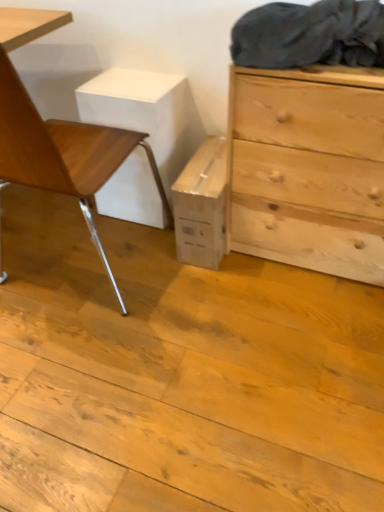
This screenshot has height=512, width=384. Describe the element at coordinates (308, 173) in the screenshot. I see `natural wood chest of drawers at right` at that location.

Image resolution: width=384 pixels, height=512 pixels. Describe the element at coordinates (58, 135) in the screenshot. I see `wooden chair at left` at that location.

At what (x,y) coordinates should I click in order to perform the action: click on natural wood chest of drawers at right. Please return your answer as a coordinate pair (x, y). The width and height of the screenshot is (384, 512). Looking at the image, I should click on (308, 173).

Consider the image. What's the angular difference between wooden chair at left and dark gray fabric at upper right's facing directions?

There is a 180-degree angle between the facing directions of wooden chair at left and dark gray fabric at upper right.

Considering the positions of points (56, 13) and (286, 5), is point (56, 13) farther from camera compared to point (286, 5)?

Yes, it is behind point (286, 5).

From the image's perspective, relative to dark gray fabric at upper right, is wooden chair at left above or below?

wooden chair at left is below dark gray fabric at upper right.

Based on their positions, is wooden chair at left located to the left or right of dark gray fabric at upper right?

In the image, wooden chair at left appears on the left side of dark gray fabric at upper right.

From the picture: From the image's perspective, is natural wood chest of drawers at right above or below dark gray fabric at upper right?

From the image's perspective, natural wood chest of drawers at right appears below dark gray fabric at upper right.

From a real-world perspective, is natural wood chest of drawers at right physically below dark gray fabric at upper right?

Yes, from a real-world perspective, natural wood chest of drawers at right is below dark gray fabric at upper right.

Considering their positions, is natural wood chest of drawers at right located in front of or behind dark gray fabric at upper right?

Visually, natural wood chest of drawers at right is located behind dark gray fabric at upper right.

Considering the relative sizes of natural wood chest of drawers at right and dark gray fabric at upper right in the image provided, is natural wood chest of drawers at right wider than dark gray fabric at upper right?

Yes, natural wood chest of drawers at right is wider than dark gray fabric at upper right.

What are the coordinates of `chest of drawers on the right of the wooden chair at left` in the screenshot? It's located at (308, 173).

From a real-world perspective, is natural wood chest of drawers at right above or below wooden chair at left?

In terms of real-world spatial position, natural wood chest of drawers at right is below wooden chair at left.

Considering the positions of objects natural wood chest of drawers at right and wooden chair at left in the image provided, who is behind, natural wood chest of drawers at right or wooden chair at left?

natural wood chest of drawers at right.

Based on their sizes in the image, would you say natural wood chest of drawers at right is bigger or smaller than wooden chair at left?

natural wood chest of drawers at right is smaller than wooden chair at left.

From their relative heights in the image, would you say dark gray fabric at upper right is taller or shorter than wooden chair at left?

Considering their sizes, dark gray fabric at upper right has less height than wooden chair at left.

From the image's perspective, between dark gray fabric at upper right and wooden chair at left, which one is located above?

dark gray fabric at upper right is shown above in the image.

Locate an element on the screen. Image resolution: width=384 pixels, height=512 pixels. laundry behind the wooden chair at left is located at coordinates (310, 35).

Looking at this image, how different are the orientations of dark gray fabric at upper right and natural wood chest of drawers at right in degrees?

The facing directions of dark gray fabric at upper right and natural wood chest of drawers at right are 0.00122 degrees apart.

Considering the sizes of objects dark gray fabric at upper right and natural wood chest of drawers at right in the image provided, who is bigger, dark gray fabric at upper right or natural wood chest of drawers at right?

Bigger between the two is natural wood chest of drawers at right.

Considering their positions, is dark gray fabric at upper right located in front of or behind natural wood chest of drawers at right?

In the image, dark gray fabric at upper right appears in front of natural wood chest of drawers at right.

In terms of width, does dark gray fabric at upper right look wider or thinner when compared to natural wood chest of drawers at right?

Considering their sizes, dark gray fabric at upper right looks slimmer than natural wood chest of drawers at right.

Is wooden chair at left outside of natural wood chest of drawers at right?

Yes, wooden chair at left is outside of natural wood chest of drawers at right.

How different are the orientations of wooden chair at left and natural wood chest of drawers at right in degrees?

They differ by 180 degrees in their facing directions.

From a real-world perspective, does wooden chair at left stand above natural wood chest of drawers at right?

Yes, from a real-world perspective, wooden chair at left is over natural wood chest of drawers at right

From the image's perspective, between wooden chair at left and natural wood chest of drawers at right, which one is located above?

wooden chair at left.

Where is `chair below the dark gray fabric at upper right (from a real-world perspective)`? chair below the dark gray fabric at upper right (from a real-world perspective) is located at coordinates (58, 135).

The width and height of the screenshot is (384, 512). I want to click on chest of drawers on the right of dark gray fabric at upper right, so click(x=308, y=173).

Based on their spatial positions, is wooden chair at left or dark gray fabric at upper right closer to natural wood chest of drawers at right?

The object closer to natural wood chest of drawers at right is dark gray fabric at upper right.

When comparing their distances from dark gray fabric at upper right, does wooden chair at left or natural wood chest of drawers at right seem further?

wooden chair at left is positioned further to the anchor dark gray fabric at upper right.

When comparing their distances from wooden chair at left, does dark gray fabric at upper right or natural wood chest of drawers at right seem further?

Based on the image, dark gray fabric at upper right appears to be further to wooden chair at left.

Based on their spatial positions, is natural wood chest of drawers at right or wooden chair at left closer to dark gray fabric at upper right?

natural wood chest of drawers at right lies closer to dark gray fabric at upper right than the other object.

Based on their spatial positions, is natural wood chest of drawers at right or dark gray fabric at upper right closer to wooden chair at left?

natural wood chest of drawers at right is closer to wooden chair at left.

From the picture: When comparing their distances from natural wood chest of drawers at right, does dark gray fabric at upper right or wooden chair at left seem closer?

dark gray fabric at upper right.

Image resolution: width=384 pixels, height=512 pixels. Find the location of `laundry located between wooden chair at left and natural wood chest of drawers at right in the left-right direction`. laundry located between wooden chair at left and natural wood chest of drawers at right in the left-right direction is located at coordinates (310, 35).